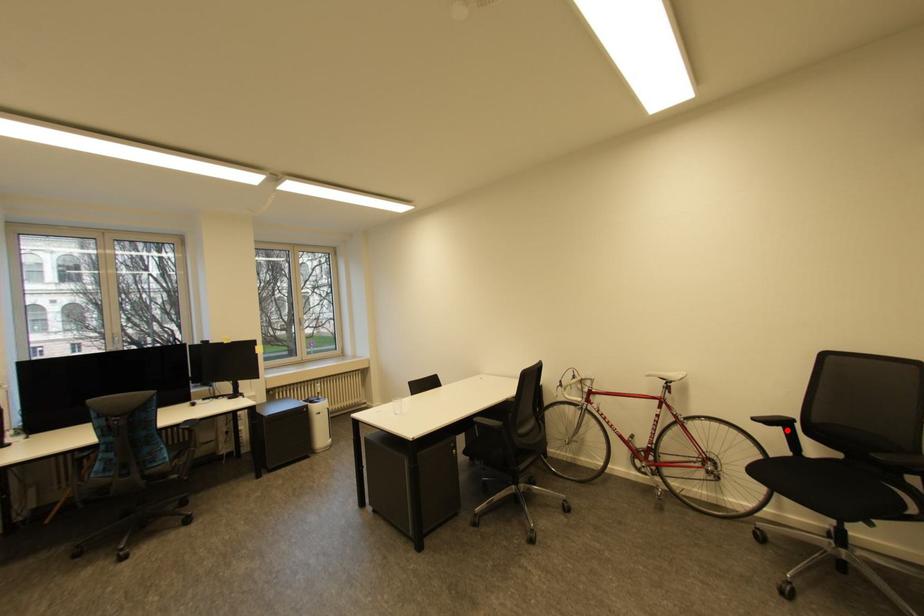
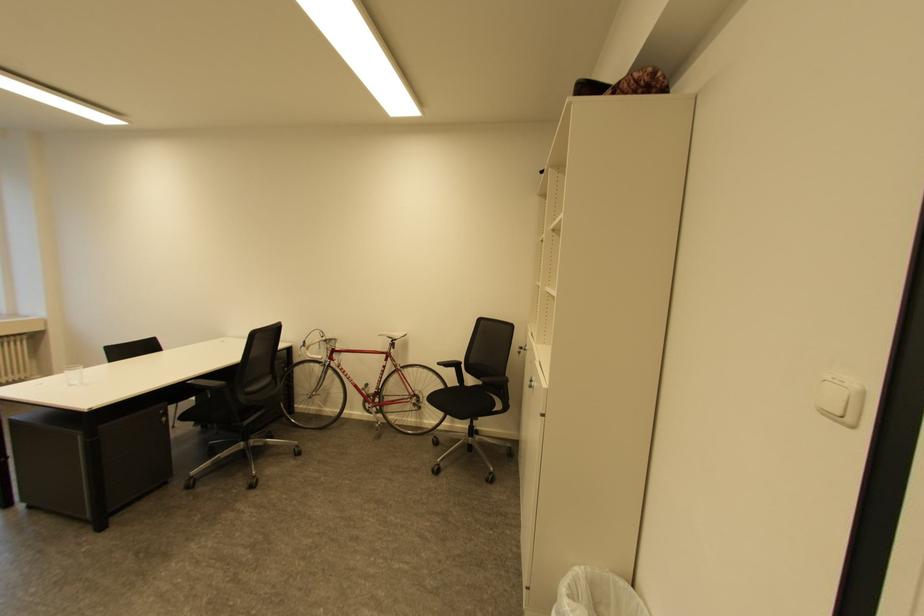
The point at the highlighted location is marked in the first image. Where is the corresponding point in the second image?

(459, 370)